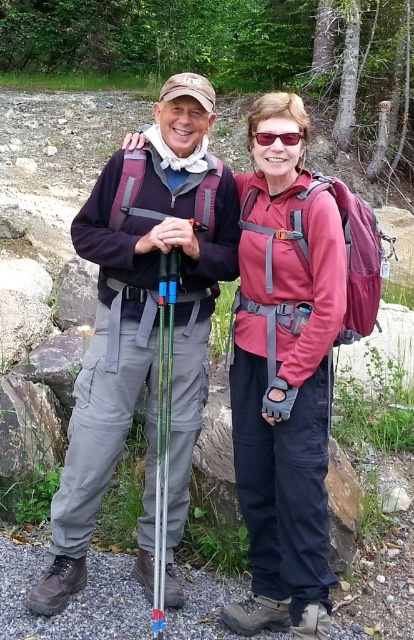
Question: Estimate the real-world distances between objects in this image. Which object is farther from the matte plastic sunglasses at center?

Choices:
 (A) green metallic ski pole at center
 (B) matte gray pants at center

Answer: (A)

Question: Estimate the real-world distances between objects in this image. Which object is closer to the matte plastic sunglasses at center?

Choices:
 (A) matte gray pants at center
 (B) green metallic ski pole at center

Answer: (A)

Question: Which point is farther to the camera?

Choices:
 (A) (159, 568)
 (B) (226, 227)
 (C) (296, 144)

Answer: (B)

Question: From the image, what is the correct spatial relationship of matte gray pants at center in relation to green metallic ski pole at center?

Choices:
 (A) above
 (B) below

Answer: (A)

Question: Is matte gray pants at center to the left of matte plastic sunglasses at center from the viewer's perspective?

Choices:
 (A) no
 (B) yes

Answer: (B)

Question: Does matte gray pants at center lie behind matte plastic sunglasses at center?

Choices:
 (A) yes
 (B) no

Answer: (A)